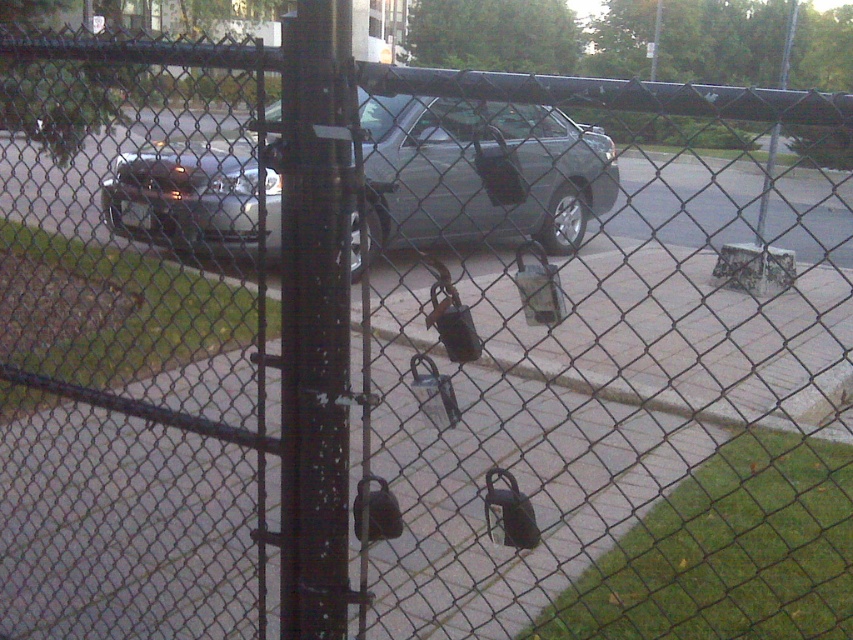
You are standing on the sidewalk and want to walk from the metallic gray car at center to the black metal pole at center. Which direction should you move to get closer to the pole?

To move closer to the black metal pole at center from the metallic gray car at center, you should walk forward since the pole is behind the car relative to your position on the sidewalk.

You are standing at the point marked as point (480,172). What object is exactly at this location?

The metallic gray car at center is exactly at point (480,172).

You are a delivery person who needs to park your 2.5 meters wide delivery van between the metallic gray car at center and the black metal pole at center. Can you fit your van there?

The metallic gray car at center is wider than the black metal pole at center. Therefore, the space between them is at least wider than the black metal pole at center. Since your van is 2.5 meters wide, you need to confirm if the available space is wider than 2.5 meters. However, the exact width of the space isn not provided, so it is uncertain if it can fit.